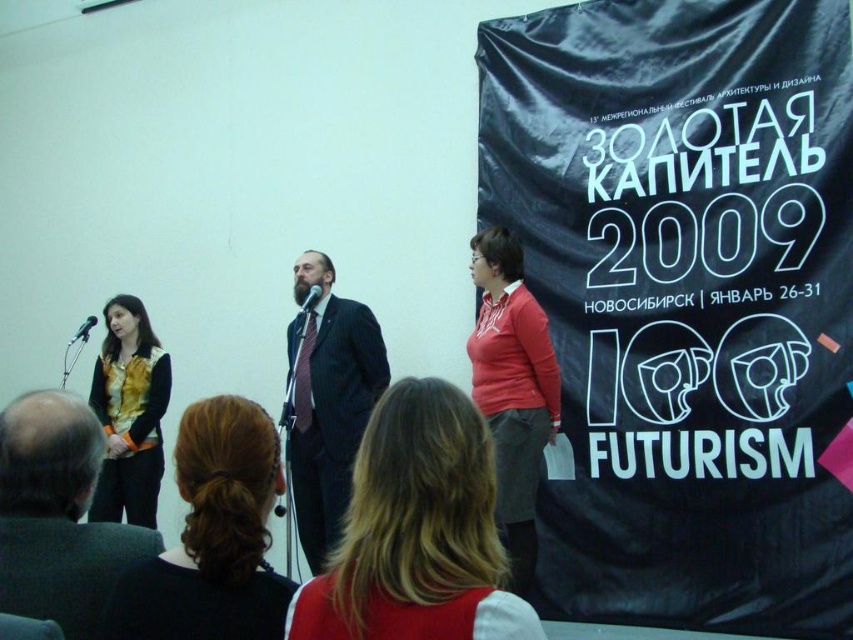
You are an attendee at the event and want to take a photo of the speaker wearing the matte black suit at center without the black metallic microphone at center blocking the view. Is this possible based on their positions?

The matte black suit at center is closer to the viewer than the black metallic microphone at center, so you can take a photo of the speaker wearing the matte black suit at center without the microphone blocking the view.

You are an attendee at this event and want to take a photo of the speaker with blonde hair at center. Where should you position yourself to capture their hair in the frame?

Position yourself so that your camera is aimed at point (416, 531) to capture the blonde hair at center in the frame.

You are an attendee at the event and want to take a photo of the dark pinstripe suit at center without including the black fabric banner at right in the frame. Is this possible given their positions?

The black fabric banner at right is closer to the viewer than the dark pinstripe suit at center, so it will block the view of the dark pinstripe suit at center. Therefore, it is not possible to take a photo of the dark pinstripe suit at center without including the black fabric banner at right in the frame.